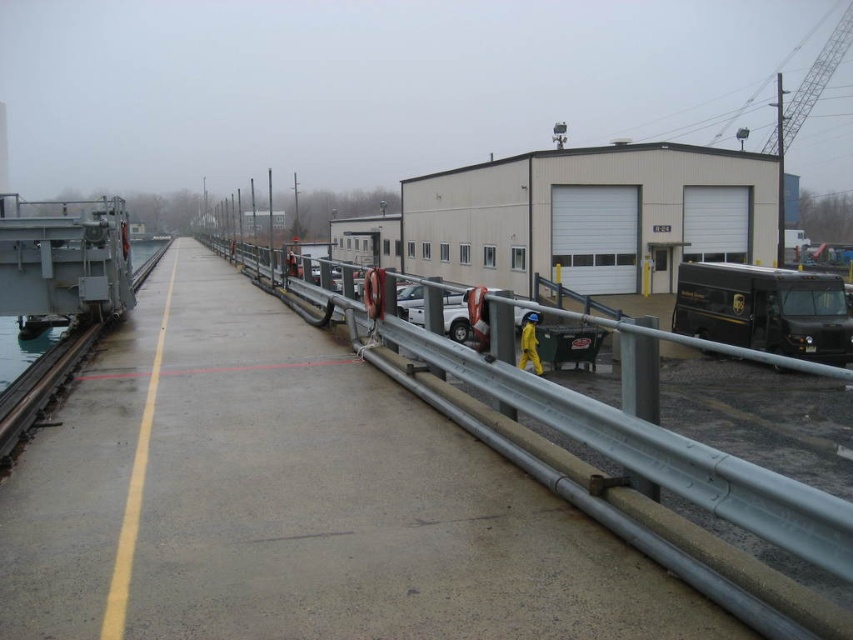
Is metal at center in front of gray metallic train track at left?

Yes, metal at center is in front of gray metallic train track at left.

Who is positioned more to the right, metal at center or gray metallic train track at left?

From the viewer's perspective, metal at center appears more on the right side.

Which is in front, point (610, 476) or point (28, 408)?

Point (610, 476) is in front.

Where is `metal at center`? Image resolution: width=853 pixels, height=640 pixels. metal at center is located at coordinates (606, 499).